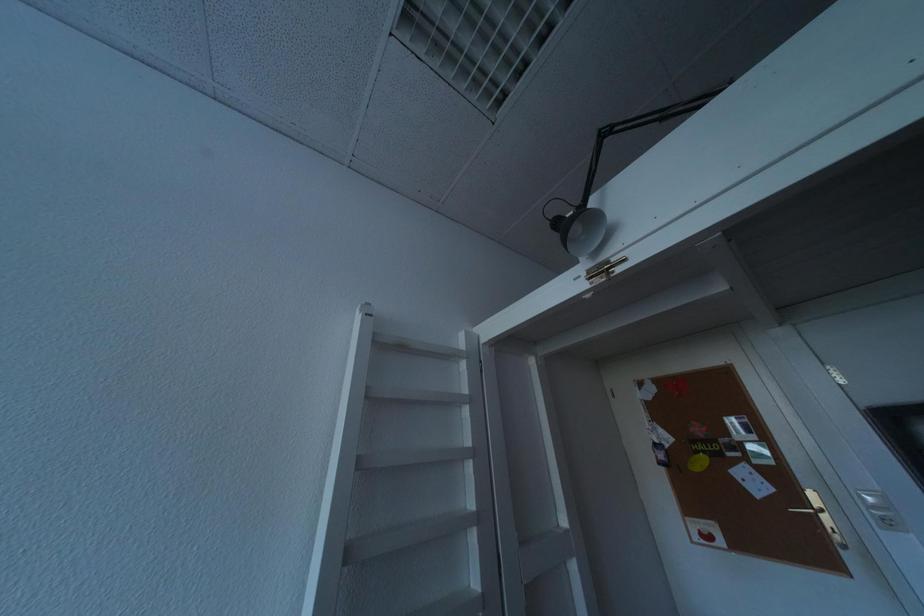
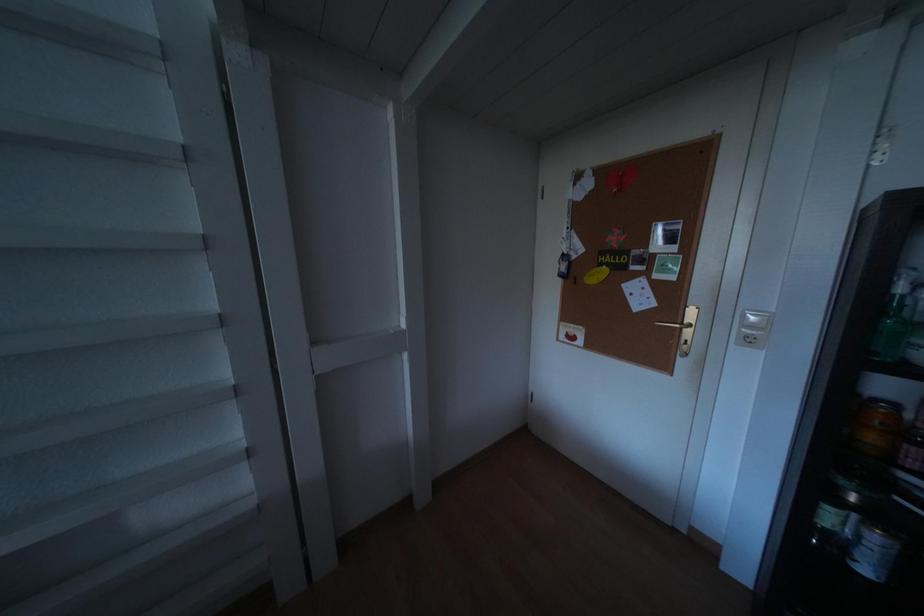
Question: The first image is from the beginning of the video and the second image is from the end. How did the camera likely rotate when shooting the video?

Choices:
 (A) Left
 (B) Right
 (C) Up
 (D) Down

Answer: (D)